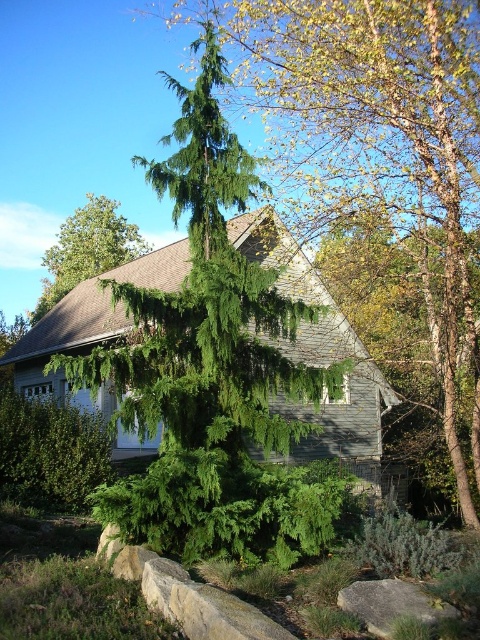
Question: Which object is closer to the camera taking this photo?

Choices:
 (A) green textured evergreen tree at upper center
 (B) gray/rough rock at lower center
 (C) gray wood cottage at center

Answer: (B)

Question: Which point is closer to the camera?

Choices:
 (A) green textured evergreen tree at upper center
 (B) gray wood cottage at center
 (C) green needle-like at center

Answer: (B)

Question: Does gray wood cottage at center lie in front of green textured evergreen tree at upper center?

Choices:
 (A) no
 (B) yes

Answer: (B)

Question: Does green needle-like at center have a larger size compared to gray wood cottage at center?

Choices:
 (A) no
 (B) yes

Answer: (B)

Question: Based on their relative distances, which object is nearer to the gray/rough rock at lower center?

Choices:
 (A) gray wood cottage at center
 (B) green textured evergreen tree at upper center

Answer: (A)

Question: Is green needle-like at center to the right of green textured evergreen tree at upper center from the viewer's perspective?

Choices:
 (A) no
 (B) yes

Answer: (B)